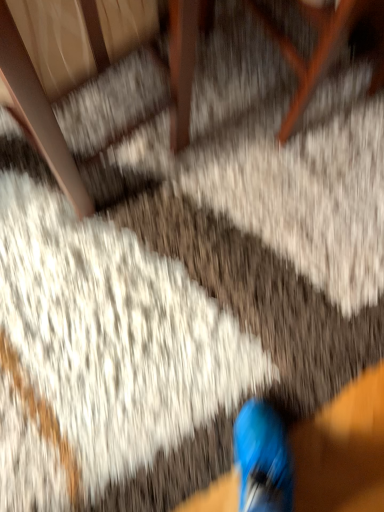
Describe the element at coordinates (323, 48) in the screenshot. The width and height of the screenshot is (384, 512). I see `wooden chair at upper right` at that location.

What are the coordinates of `wooden chair at upper right` in the screenshot? It's located at (323, 48).

Describe the element at coordinates (38, 113) in the screenshot. I see `wooden armchair at upper left` at that location.

I want to click on wooden armchair at upper left, so click(38, 113).

You are a GUI agent. You are given a task and a screenshot of the screen. Output one action in this format:
    pyautogui.click(x=<x>, y=<y>)
    Task: Click on the wooden chair at upper right
    This screenshot has height=512, width=384.
    Given the screenshot: What is the action you would take?
    pos(323,48)

Does wooden chair at upper right appear on the right side of wooden armchair at upper left?

Indeed, wooden chair at upper right is positioned on the right side of wooden armchair at upper left.

Which is in front, wooden chair at upper right or wooden armchair at upper left?

wooden armchair at upper left is in front.

Is point (332, 15) closer or farther from the camera than point (33, 106)?

Clearly, point (332, 15) is more distant from the camera than point (33, 106).

From the image's perspective, is wooden chair at upper right on wooden armchair at upper left?

Correct, wooden chair at upper right appears higher than wooden armchair at upper left in the image.

From a real-world perspective, is wooden chair at upper right positioned over wooden armchair at upper left based on gravity?

No, from a real-world perspective, wooden chair at upper right is not over wooden armchair at upper left

Which of these two, wooden chair at upper right or wooden armchair at upper left, is thinner?

Thinner between the two is wooden armchair at upper left.

Does wooden chair at upper right have a lesser height compared to wooden armchair at upper left?

Correct, wooden chair at upper right is not as tall as wooden armchair at upper left.

Considering the relative sizes of wooden chair at upper right and wooden armchair at upper left in the image provided, is wooden chair at upper right smaller than wooden armchair at upper left?

Correct, wooden chair at upper right occupies less space than wooden armchair at upper left.

Would you say wooden armchair at upper left is part of wooden chair at upper right's contents?

Definitely not — wooden armchair at upper left is not inside wooden chair at upper right.

Is wooden chair at upper right beside wooden armchair at upper left?

wooden chair at upper right is not next to wooden armchair at upper left, and they're not touching.

Is wooden chair at upper right oriented away from wooden armchair at upper left?

wooden chair at upper right is not turned away from wooden armchair at upper left.

Measure the distance from wooden chair at upper right to wooden armchair at upper left.

They are 21.75 inches apart.

Find the location of a particular element. This screenshot has width=384, height=512. armchair located in front of the wooden chair at upper right is located at coordinates pyautogui.click(x=38, y=113).

Which object is positioned more to the left, wooden armchair at upper left or wooden chair at upper right?

wooden armchair at upper left is more to the left.

Is wooden armchair at upper left further to camera compared to wooden chair at upper right?

That is False.

Considering the points (16, 113) and (298, 64), which point is in front, point (16, 113) or point (298, 64)?

The point (16, 113) is more forward.

From the image's perspective, is wooden armchair at upper left on top of wooden chair at upper right?

No, from the image's perspective, wooden armchair at upper left is not above wooden chair at upper right.

From a real-world perspective, who is located lower, wooden armchair at upper left or wooden chair at upper right?

wooden chair at upper right, from a real-world perspective.

Does wooden armchair at upper left have a lesser width compared to wooden chair at upper right?

Indeed, wooden armchair at upper left has a lesser width compared to wooden chair at upper right.

Is wooden armchair at upper left taller than wooden chair at upper right?

Yes.

Between wooden armchair at upper left and wooden chair at upper right, which one has smaller size?

wooden chair at upper right.

Is wooden armchair at upper left not inside wooden chair at upper right?

Yes, wooden armchair at upper left is located beyond the bounds of wooden chair at upper right.

Is wooden armchair at upper left far away from wooden chair at upper right?

wooden armchair at upper left is actually quite close to wooden chair at upper right.

From the picture: Could you tell me if wooden armchair at upper left is facing wooden chair at upper right?

No, wooden armchair at upper left is not oriented towards wooden chair at upper right.

Measure the distance between wooden armchair at upper left and wooden chair at upper right.

55.24 centimeters.

This screenshot has width=384, height=512. Find the location of `furniture behind the wooden armchair at upper left`. furniture behind the wooden armchair at upper left is located at coordinates (323, 48).

Where is `furniture above the wooden armchair at upper left (from the image's perspective)`? This screenshot has width=384, height=512. furniture above the wooden armchair at upper left (from the image's perspective) is located at coordinates (323, 48).

Identify the location of furniture behind the wooden armchair at upper left. This screenshot has height=512, width=384. (323, 48).